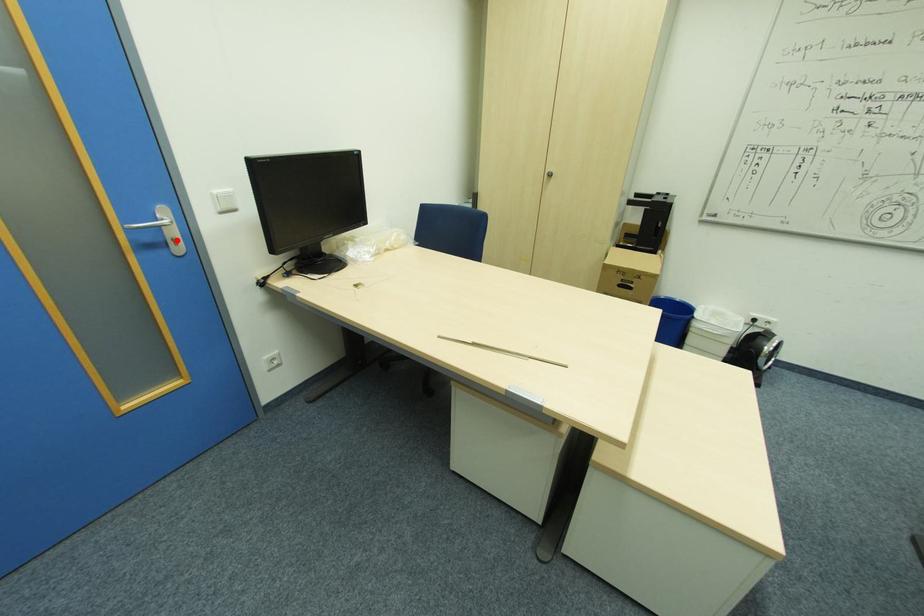
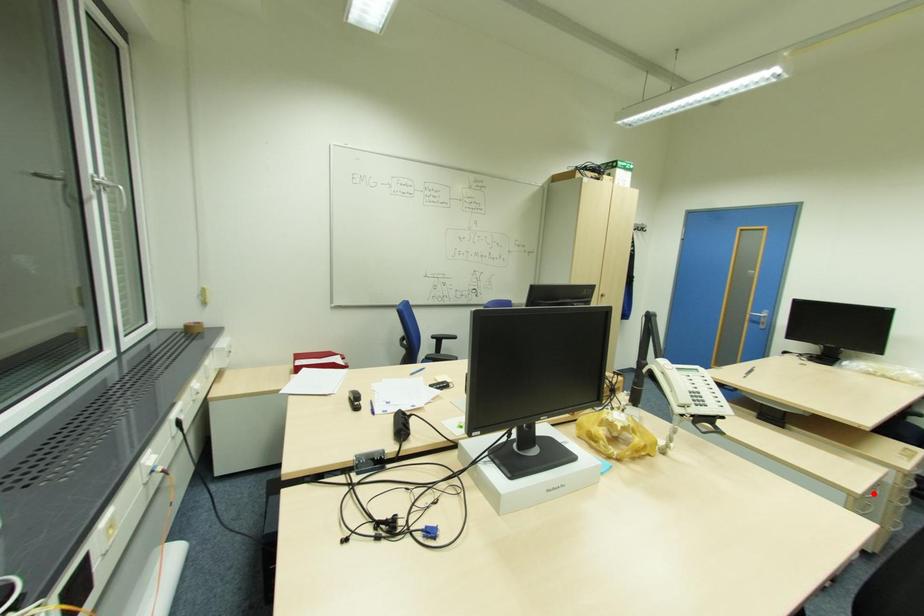
I am providing you with two images of the same scene from different viewpoints. A red point is marked on the first image and another point is marked on the second image. Are the points marked in image1 and image2 representing the same 3D position?

No